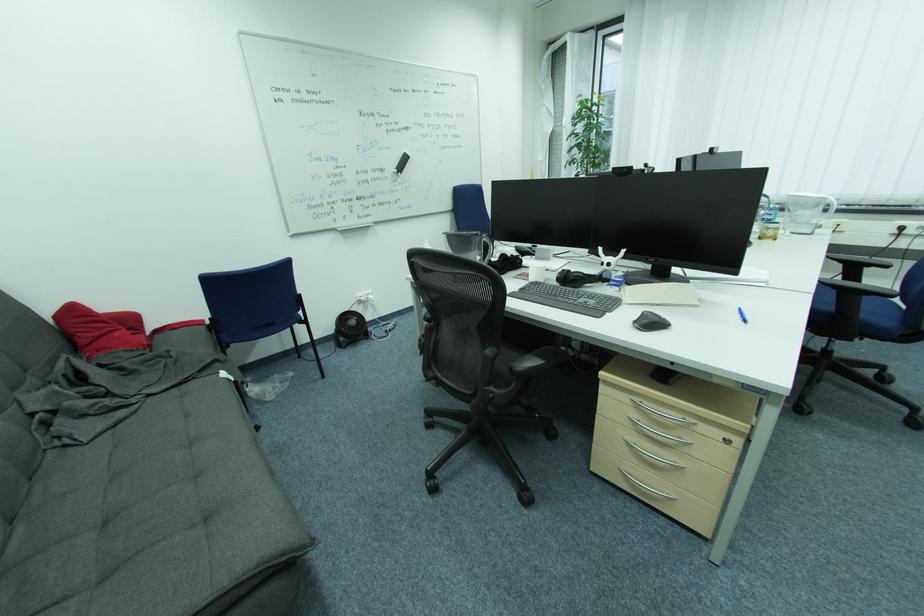
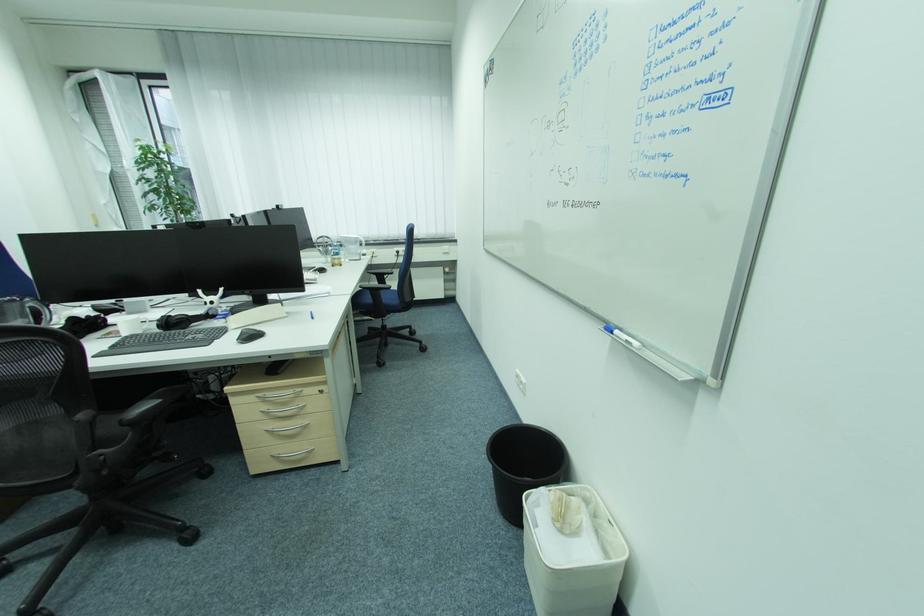
The point at (517, 370) is marked in the first image. Where is the corresponding point in the second image?

(128, 422)